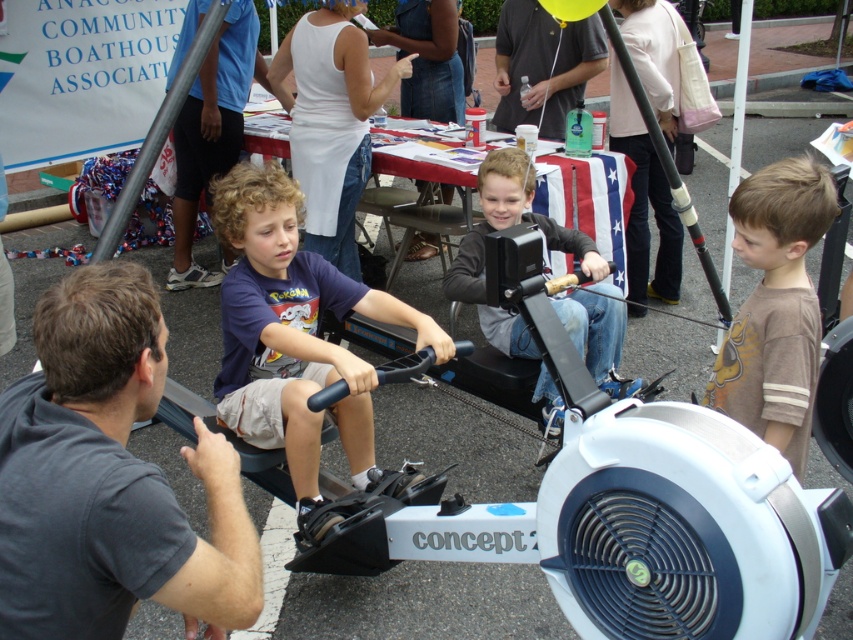
Question: Is dark blue cotton shirt at center thinner than matte black rowing machine at center?

Choices:
 (A) yes
 (B) no

Answer: (B)

Question: Can you confirm if dark gray shirt at center is positioned above brown cotton shirt at right?

Choices:
 (A) yes
 (B) no

Answer: (B)

Question: Is dark blue cotton shirt at center wider than dark gray shirt at upper center?

Choices:
 (A) no
 (B) yes

Answer: (B)

Question: Which point is closer to the camera?

Choices:
 (A) [229, 288]
 (B) [606, 317]
 (C) [184, 256]

Answer: (A)

Question: Which point is closer to the camera?

Choices:
 (A) dark blue cotton shirt at center
 (B) dark gray shirt at center

Answer: (B)

Question: Among these objects, which one is farthest from the camera?

Choices:
 (A) dark blue cotton shirt at center
 (B) dark blue shirt at center
 (C) brown cotton shirt at right
 (D) dark gray shirt at upper center

Answer: (B)